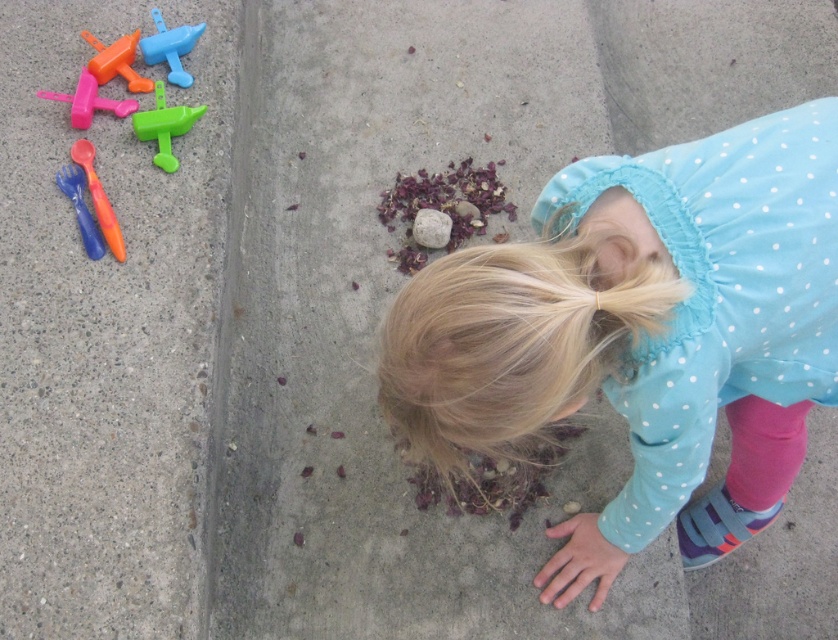
You are a robot trying to navigate the concrete area where the child is playing. You need to move from point A at coordinates point (180, 76) to point B at coordinates point (110, 74). According to the image, which direction should you move to get from point A to point B?

Point (180, 76) is behind point (110, 74), so to move from point A to point B, you should move forward towards the direction of point B.